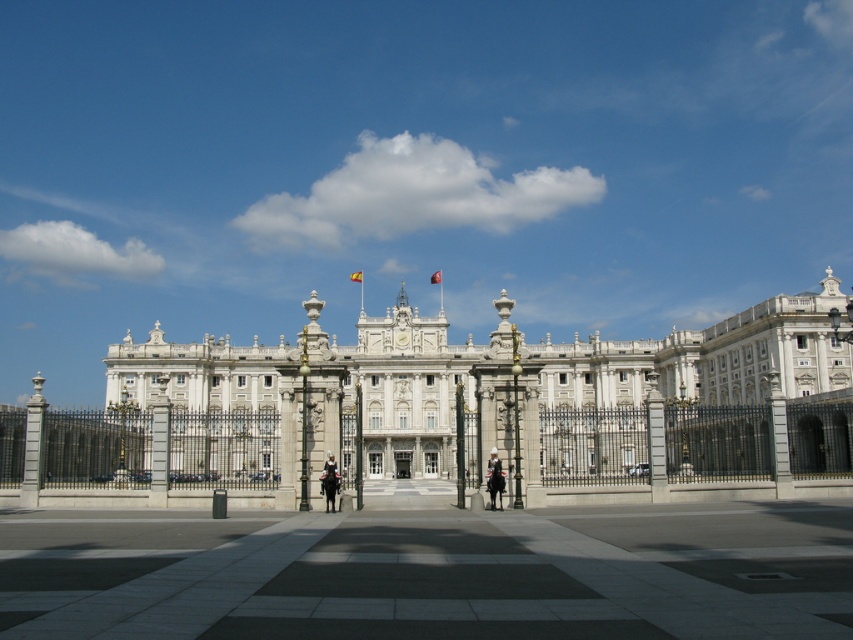
Question: Does gray concrete plaza at center appear on the right side of white stone palace at center?

Choices:
 (A) yes
 (B) no

Answer: (B)

Question: From the image, what is the correct spatial relationship of white stone palace at center in relation to smooth black uniform at center?

Choices:
 (A) left
 (B) right

Answer: (B)

Question: From the image, what is the correct spatial relationship of white stone palace at center in relation to smooth black uniform at center?

Choices:
 (A) above
 (B) below

Answer: (A)

Question: Which of these objects is positioned farthest from the white stone palace at center?

Choices:
 (A) smooth black uniform at center
 (B) uniformed officer on horseback at center
 (C) gray concrete plaza at center

Answer: (B)

Question: Which point appears closest to the camera in this image?

Choices:
 (A) (445, 556)
 (B) (490, 506)
 (C) (325, 483)
 (D) (428, 474)

Answer: (A)

Question: Which point is closer to the camera taking this photo?

Choices:
 (A) (206, 529)
 (B) (332, 483)
 (C) (619, 397)
 (D) (490, 456)

Answer: (A)